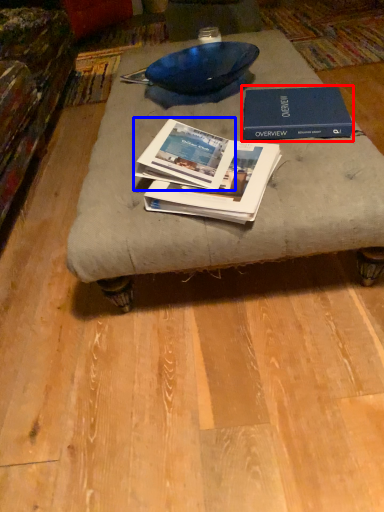
Question: Which of the following is the closest to the observer, book (highlighted by a red box) or book (highlighted by a blue box)?

Choices:
 (A) book
 (B) book

Answer: (B)